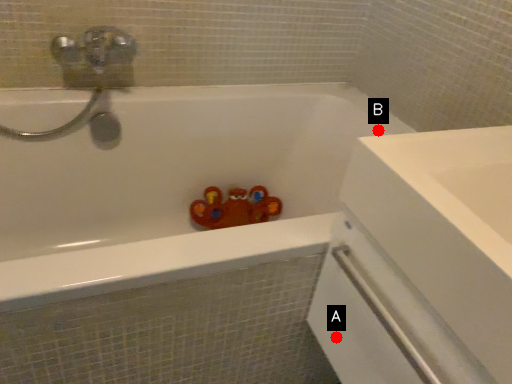
Question: Two points are circled on the image, labeled by A and B beside each circle. Which point appears farthest from the camera in this image?

Choices:
 (A) A is further
 (B) B is further

Answer: (B)